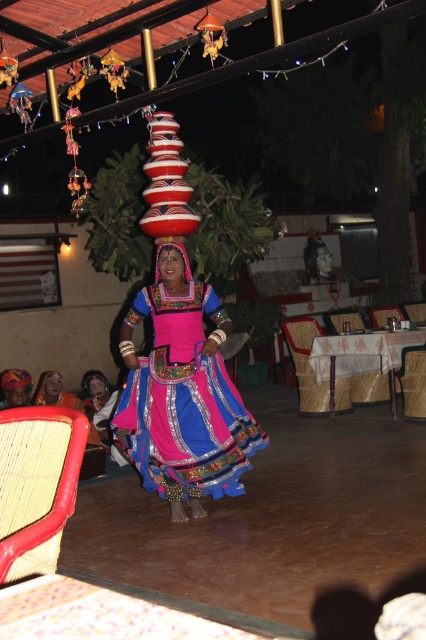
Which of these two, matte black head at center or matte pink fabric head at center, stands taller?

With more height is matte pink fabric head at center.

Who is more forward, [26,392] or [40,401]?

Point [26,392] is more forward.

The width and height of the screenshot is (426, 640). Identify the location of matte black head at center. (14, 387).

Locate an element on the screen. The image size is (426, 640). matte black head at center is located at coordinates (14, 387).

Does shiny blue fabric at center have a smaller size compared to red woven chair at lower left?

No, shiny blue fabric at center is not smaller than red woven chair at lower left.

Is the position of shiny blue fabric at center less distant than that of red woven chair at lower left?

No, shiny blue fabric at center is further to the viewer.

Locate an element on the screen. Image resolution: width=426 pixels, height=640 pixels. shiny blue fabric at center is located at coordinates (183, 396).

Is matte black head at center wider than matte pink fabric headress at center?

Yes, matte black head at center is wider than matte pink fabric headress at center.

Does matte black head at center appear on the right side of matte pink fabric headress at center?

In fact, matte black head at center is to the left of matte pink fabric headress at center.

Is point (9, 404) less distant than point (186, 276)?

No.

Image resolution: width=426 pixels, height=640 pixels. I want to click on matte black head at center, so click(x=14, y=387).